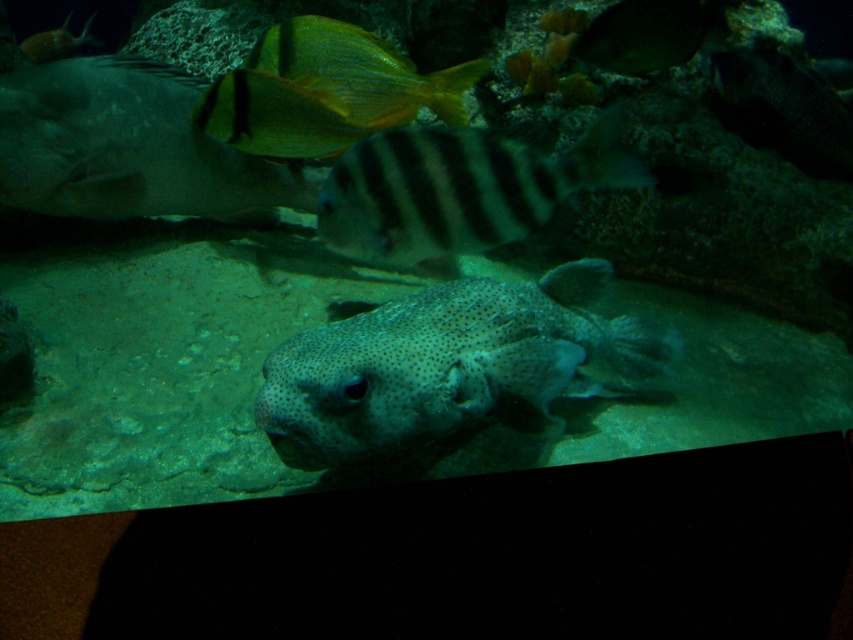
Who is more distant from viewer, [302,52] or [54,40]?

The point [54,40] is behind.

In the scene shown: Who is more forward, (331, 42) or (61, 38)?

Point (331, 42)

Where is `yellow shiny fish at upper center`? Image resolution: width=853 pixels, height=640 pixels. yellow shiny fish at upper center is located at coordinates (360, 70).

Who is more forward, (230, 145) or (372, 173)?

Point (372, 173) is in front.

Is point (42, 96) positioned before point (459, 227)?

No, (42, 96) is further to viewer.

At what (x,y) coordinates should I click in order to perform the action: click on smooth gray shark at upper left. Please return your answer as a coordinate pair (x, y). This screenshot has width=853, height=640. Looking at the image, I should click on (126, 147).

Does yellow-green striped fish at upper center have a greater width compared to shiny silver fish at upper right?

Correct, the width of yellow-green striped fish at upper center exceeds that of shiny silver fish at upper right.

Is the position of yellow-green striped fish at upper center more distant than that of shiny silver fish at upper right?

No.

Who is more distant from viewer, [259,140] or [595,58]?

The point [595,58] is more distant.

The height and width of the screenshot is (640, 853). What are the coordinates of `yellow-green striped fish at upper center` in the screenshot? It's located at (277, 116).